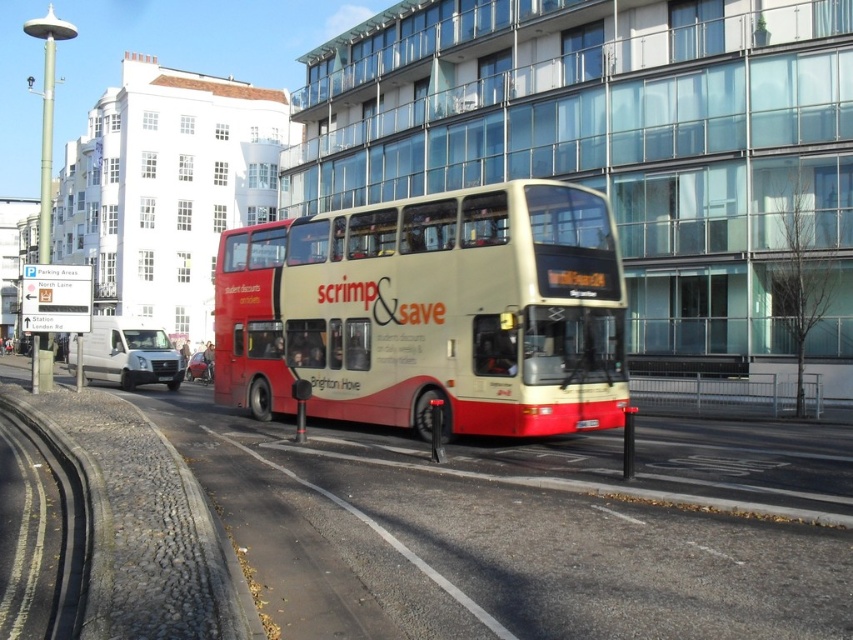
Question: Where is matte cream double-decker bus at center located in relation to yellow matte license plate at center in the image?

Choices:
 (A) above
 (B) below

Answer: (A)

Question: Which point is farther to the camera?

Choices:
 (A) yellow matte license plate at center
 (B) matte cream double-decker bus at center

Answer: (A)

Question: Which point is closer to the camera?

Choices:
 (A) matte cream double-decker bus at center
 (B) yellow matte license plate at center

Answer: (A)

Question: Considering the relative positions of matte cream double-decker bus at center and yellow matte license plate at center in the image provided, where is matte cream double-decker bus at center located with respect to yellow matte license plate at center?

Choices:
 (A) above
 (B) below

Answer: (A)

Question: Is matte cream double-decker bus at center above yellow matte license plate at center?

Choices:
 (A) yes
 (B) no

Answer: (A)